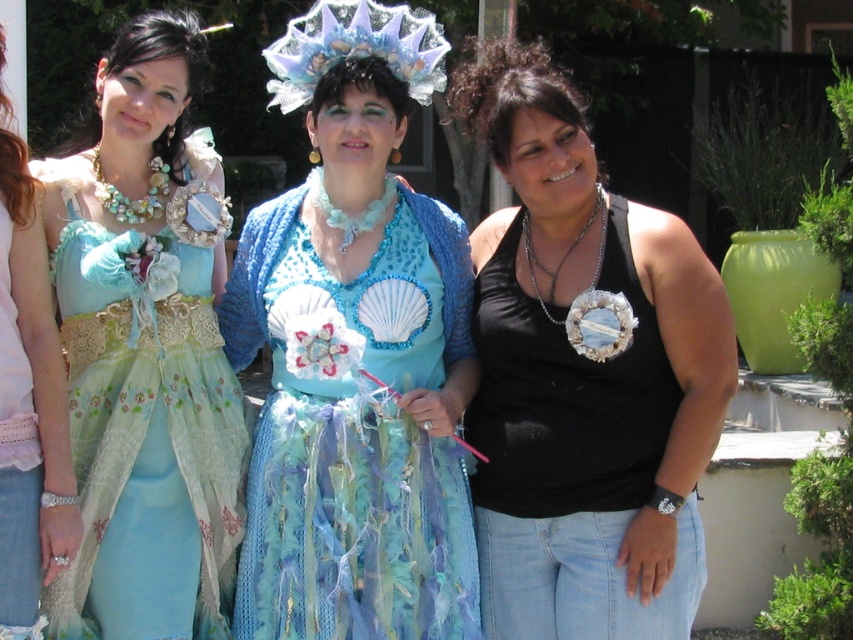
You are at the center of the image and want to move towards the shiny blue fabric dress at center. Which direction should you move to reach it?

The shiny blue fabric dress at center is located at point (355, 355), so you should move towards the center of the image to reach it.

You are standing at the camera position and want to reach point (450,602). Can you walk directly to it without needing to move around any obstacles?

The distance between you and point (450,602) is 4.23 meters. Since there are no obstacles mentioned in the scene description, you can walk directly to it.